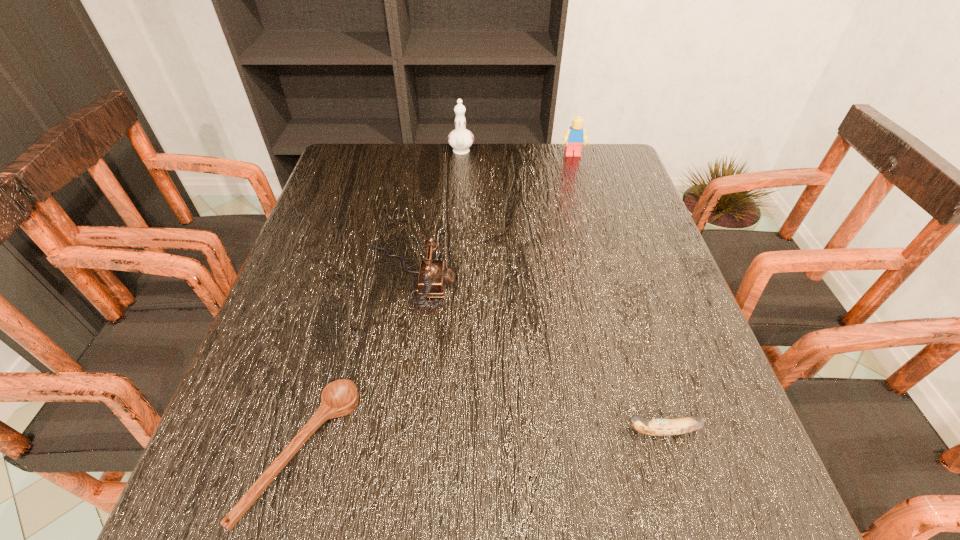
Find the location of a particular element. object that is at the near left corner is located at coordinates (339, 398).

What are the coordinates of `object that is at the far right corner` in the screenshot? It's located at (575, 136).

In the image, there is a desktop. Where is `free space at the far edge`? The height and width of the screenshot is (540, 960). free space at the far edge is located at coordinates (538, 172).

Identify the location of vacant space at the near edge. (407, 480).

What are the coordinates of `vacant space at the right edge` in the screenshot? It's located at (687, 393).

Where is `vacant area at the far left corner`? vacant area at the far left corner is located at coordinates (340, 149).

Where is `free space at the far right corner of the desktop`? The height and width of the screenshot is (540, 960). free space at the far right corner of the desktop is located at coordinates (577, 177).

At what (x,y) coordinates should I click in order to perform the action: click on free space at the near right corner of the desktop. Please return your answer as a coordinate pair (x, y). The width and height of the screenshot is (960, 540). Looking at the image, I should click on (755, 480).

In order to click on empty space between the Lego and the third nearest object in this screenshot , I will do `click(490, 217)`.

This screenshot has height=540, width=960. In order to click on free space between the telephone and the Lego in this screenshot , I will do `click(490, 217)`.